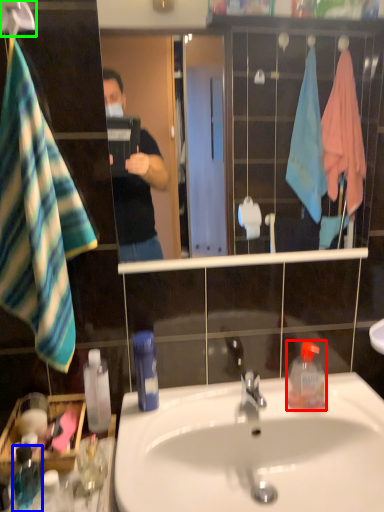
Question: Which object is positioned closest to bottle (highlighted by a red box)? Select from bottle (highlighted by a blue box) and hanger (highlighted by a green box).

Choices:
 (A) bottle
 (B) hanger

Answer: (A)